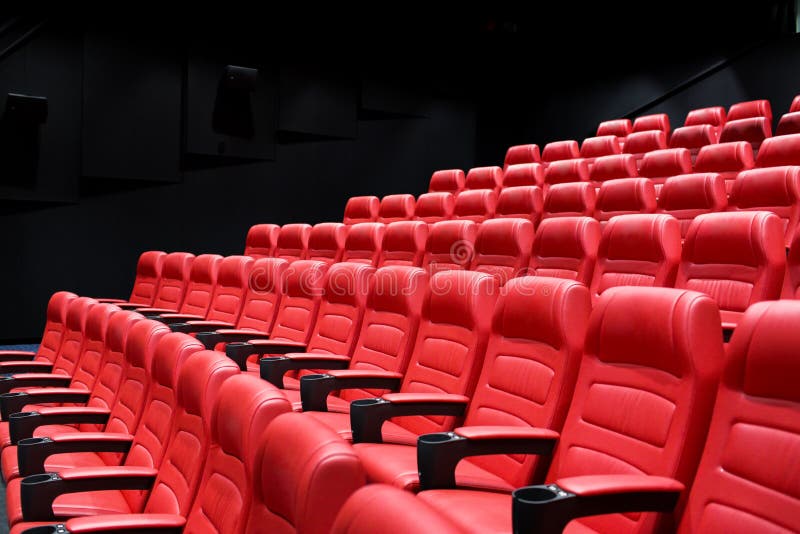
At what (x,y) coordinates should I click in order to perform the action: click on theater seat in sixth row. Please return your answer as a coordinate pair (x, y). This screenshot has height=534, width=800. Looking at the image, I should click on (790, 124), (734, 128), (694, 139), (649, 140), (605, 145), (564, 145), (524, 156).